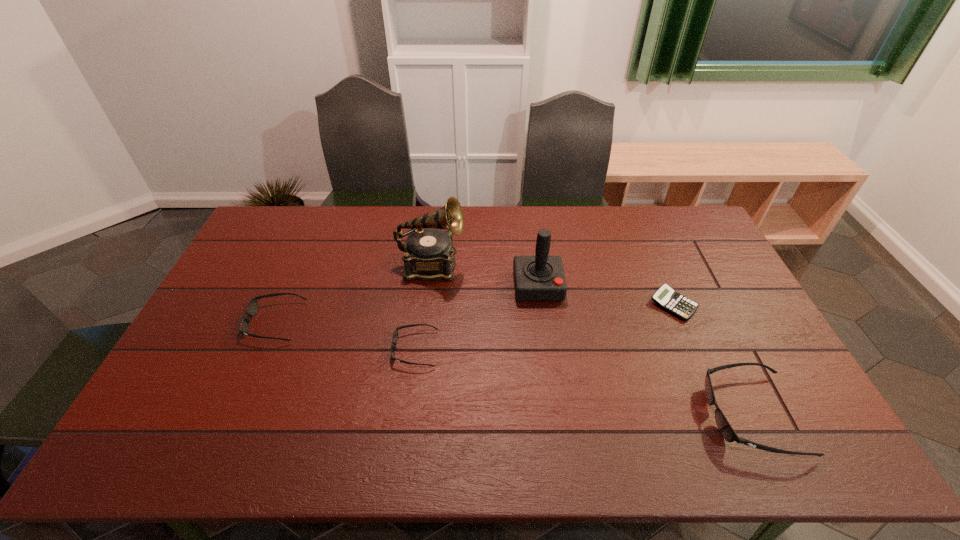
Locate an element on the screen. vacant space situated 0.050m on the front-facing side of the second tallest sunglasses is located at coordinates (231, 322).

Locate an element on the screen. The width and height of the screenshot is (960, 540). vacant space located on the front-facing side of the second tallest sunglasses is located at coordinates (204, 322).

I want to click on free space located 0.060m on the front-facing side of the second tallest sunglasses, so click(228, 322).

The height and width of the screenshot is (540, 960). I want to click on vacant point located 0.110m on the front-facing side of the shortest sunglasses, so click(x=354, y=349).

The height and width of the screenshot is (540, 960). What are the coordinates of `free space located 0.170m on the front-facing side of the shortest sunglasses` in the screenshot? It's located at (333, 349).

At what (x,y) coordinates should I click in order to perform the action: click on free space located on the front-facing side of the shortest sunglasses. Please return your answer as a coordinate pair (x, y). Looking at the image, I should click on (294, 349).

The height and width of the screenshot is (540, 960). Find the location of `vacant area located on the front-facing side of the rightmost sunglasses`. vacant area located on the front-facing side of the rightmost sunglasses is located at coordinates (580, 415).

The width and height of the screenshot is (960, 540). What are the coordinates of `vacant region located on the front-facing side of the rightmost sunglasses` in the screenshot? It's located at (639, 415).

The width and height of the screenshot is (960, 540). I want to click on vacant area situated on the front-facing side of the rightmost sunglasses, so click(643, 415).

Locate an element on the screen. free space located 0.320m on the base of the third object from right to left is located at coordinates (552, 395).